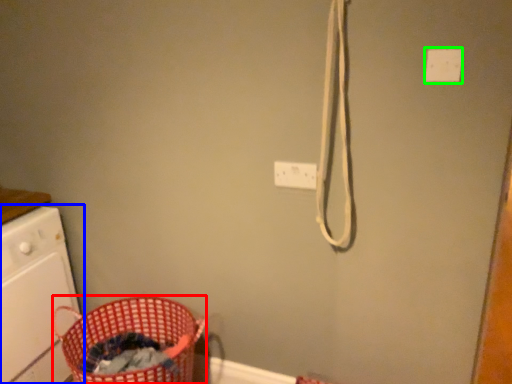
Question: Which object is positioned closest to basket (highlighted by a red box)? Select from home appliance (highlighted by a blue box) and light switch (highlighted by a green box).

Choices:
 (A) home appliance
 (B) light switch

Answer: (A)